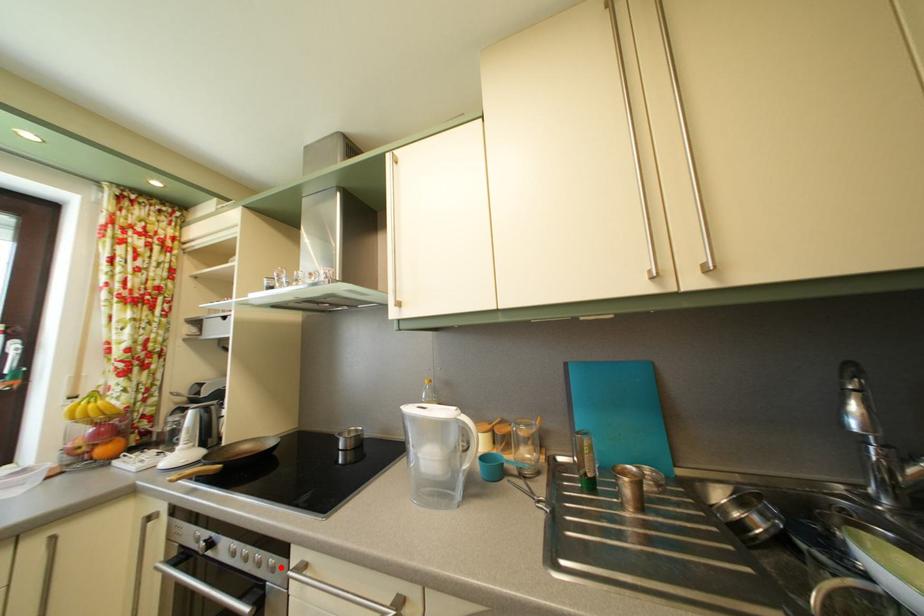
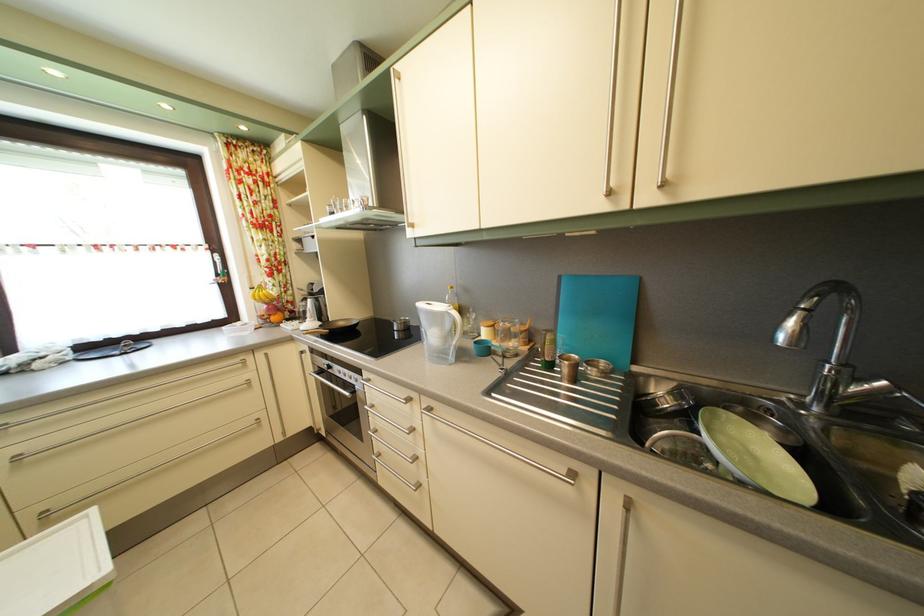
The point at the highlighted location is marked in the first image. Where is the corresponding point in the second image?

(365, 384)